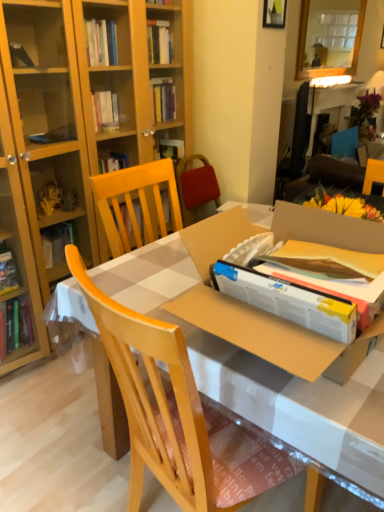
Question: From a real-world perspective, relative to glossy wooden mirror at upper center, is cardboard box at center vertically above or below?

Choices:
 (A) above
 (B) below

Answer: (B)

Question: In the image, is cardboard box at center on the left side or the right side of glossy wooden mirror at upper center?

Choices:
 (A) right
 (B) left

Answer: (B)

Question: Which object is the farthest from the cardboard box at center?

Choices:
 (A) wooden picture frame at upper center
 (B) light wood chair at center
 (C) glossy wooden mirror at upper center

Answer: (C)

Question: Estimate the real-world distances between objects in this image. Which object is farther from the wooden picture frame at upper center?

Choices:
 (A) glossy wooden mirror at upper center
 (B) cardboard box at center
 (C) light wood chair at center

Answer: (C)